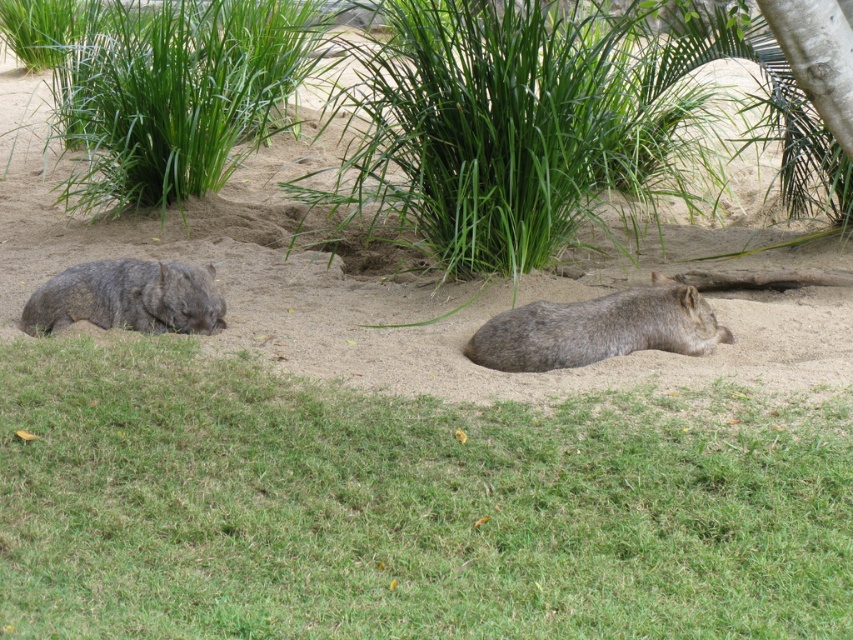
Question: Which point is closer to the camera taking this photo?

Choices:
 (A) (222, 320)
 (B) (834, 460)
 (C) (71, 195)
 (D) (671, 36)

Answer: (B)

Question: Which point appears closest to the camera in this image?

Choices:
 (A) (792, 445)
 (B) (631, 312)
 (C) (90, 84)

Answer: (A)

Question: Can you confirm if green leafy grass at upper center is positioned to the left of green leafy grass at upper left?

Choices:
 (A) no
 (B) yes

Answer: (A)

Question: Which point is closer to the camera?

Choices:
 (A) green grass at lower center
 (B) brown furry wombat at center
 (C) green leafy grass at upper center
 (D) gray furry wombat at left

Answer: (A)

Question: Can you confirm if green grass at lower center is positioned to the left of brown furry wombat at center?

Choices:
 (A) yes
 (B) no

Answer: (A)

Question: Can you confirm if green grass at lower center is thinner than gray furry wombat at left?

Choices:
 (A) yes
 (B) no

Answer: (B)